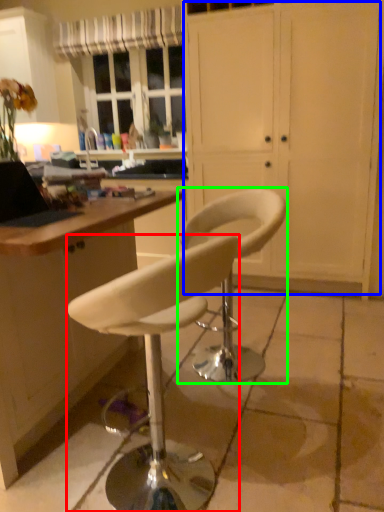
Question: Estimate the real-world distances between objects in this image. Which object is closer to chair (highlighted by a red box), screen door (highlighted by a blue box) or chair (highlighted by a green box)?

Choices:
 (A) screen door
 (B) chair

Answer: (B)